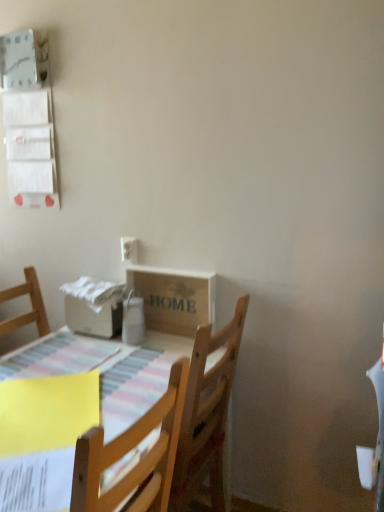
Question: Is point pyautogui.click(x=137, y=261) closer or farther from the camera than point pyautogui.click(x=49, y=368)?

Choices:
 (A) closer
 (B) farther

Answer: (B)

Question: From a real-world perspective, is white plastic electric outlet at upper left physically located above or below wooden table at lower left?

Choices:
 (A) above
 (B) below

Answer: (A)

Question: Estimate the real-world distances between objects in this image. Which object is farther from the wooden table at lower left?

Choices:
 (A) white plastic electric outlet at upper left
 (B) wooden crate at center

Answer: (A)

Question: Which is farther from the white plastic electric outlet at upper left?

Choices:
 (A) wooden crate at center
 (B) wooden table at lower left

Answer: (B)